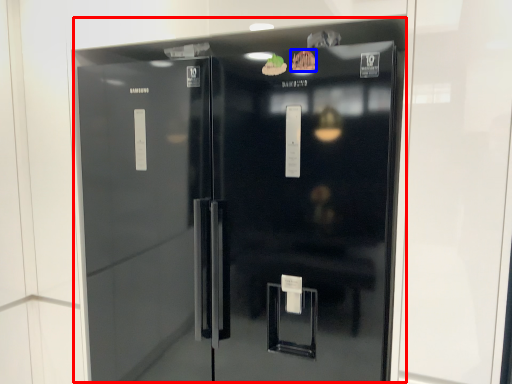
Question: Which object appears closest to the camera in this image, refrigerator (highlighted by a red box) or food (highlighted by a blue box)?

Choices:
 (A) refrigerator
 (B) food

Answer: (A)